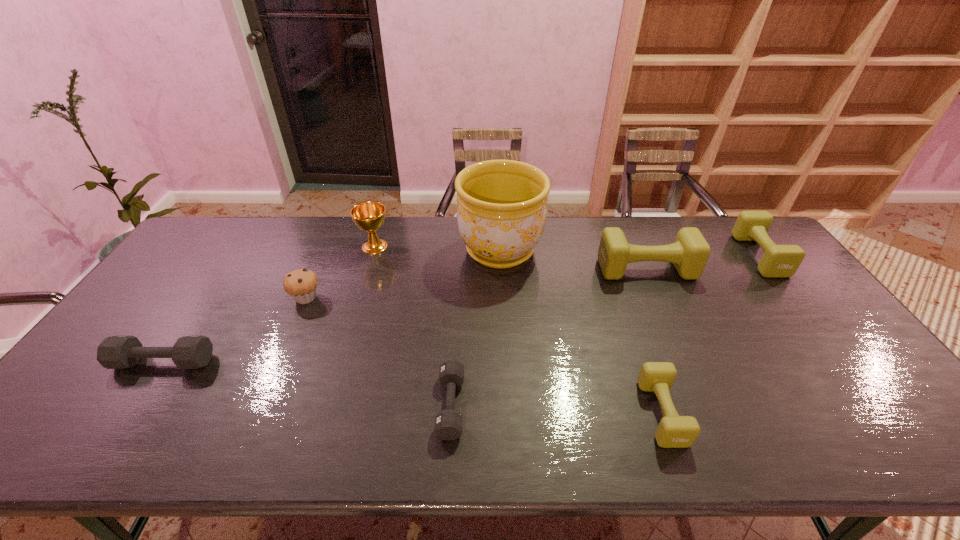
This screenshot has height=540, width=960. I want to click on object that is the second closest to the second smallest olive dumbbell, so click(x=674, y=431).

Identify the location of dumbbell that stands as the second closest to the tallest dumbbell. The height and width of the screenshot is (540, 960). (674, 431).

Identify which dumbbell is the closest to the shortest object. Please provide its 2D coordinates. Your answer should be formatted as a tuple, i.e. [(x, y)], where the tuple contains the x and y coordinates of a point satisfying the conditions above.

[(674, 431)]

Find the location of a particular element. This screenshot has width=960, height=540. olive dumbbell that stands as the second closest to the leftmost dumbbell is located at coordinates (689, 253).

Point out which olive dumbbell is positioned as the nearest to the shortest dumbbell. Please provide its 2D coordinates. Your answer should be formatted as a tuple, i.e. [(x, y)], where the tuple contains the x and y coordinates of a point satisfying the conditions above.

[(674, 431)]

Find the location of `free point that satisfies the following two spatial constraints: 1. on the front side of the second biggest olive dumbbell; 2. on the right side of the gold chalice`. free point that satisfies the following two spatial constraints: 1. on the front side of the second biggest olive dumbbell; 2. on the right side of the gold chalice is located at coordinates (372, 255).

Locate an element on the screen. The width and height of the screenshot is (960, 540). free space that satisfies the following two spatial constraints: 1. on the front side of the nearest olive dumbbell; 2. on the right side of the gold chalice is located at coordinates (325, 413).

Where is `vacant space that satisfies the following two spatial constraints: 1. on the front side of the rightmost olive dumbbell; 2. on the right side of the flowerpot`? The height and width of the screenshot is (540, 960). vacant space that satisfies the following two spatial constraints: 1. on the front side of the rightmost olive dumbbell; 2. on the right side of the flowerpot is located at coordinates (500, 255).